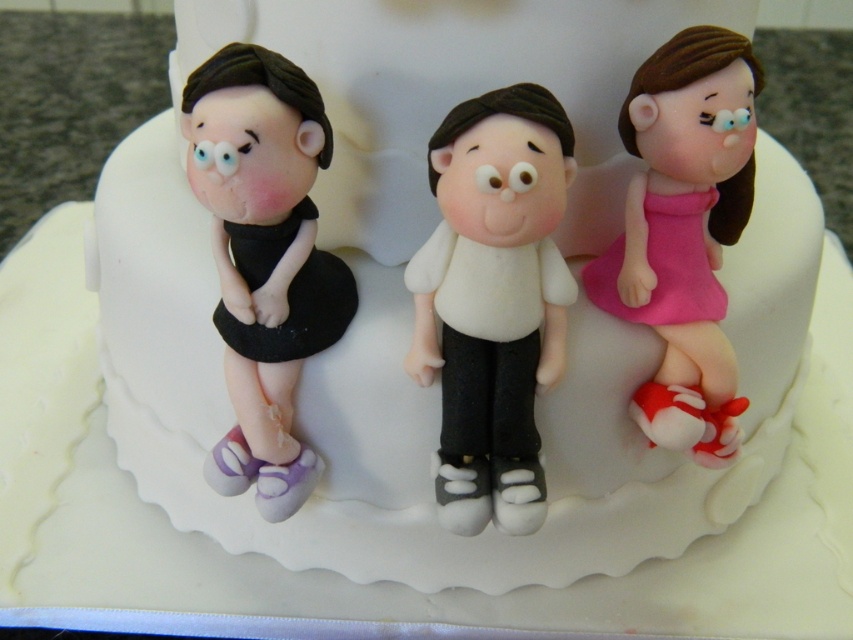
You are looking at the cake topper and notice two points marked on it. The first point is at coordinate point (502,128) and the second is at point (642,132). Which of these points is closer to you?

Point (502,128) is closer to the viewer than point (642,132).

You are a photographer setting up a shot of the cake topper. The matte black dress at left is part of the scene. You want to ensure the dress is in focus while keeping the camera at a fixed position. What should you adjust to achieve this?

To ensure the matte black dress at left is in focus while keeping the camera at a fixed position, you should adjust the camera lens to focus on the matte black dress at left. Since the matte black dress at left and the camera are 70.46 centimeters apart, setting the focus distance to approximately 70.46 centimeters would bring the dress into sharp focus.

You are designing a display stand for the white matte figure at center and the pink matte dress at right. Which object requires a wider base to prevent tipping over?

The white matte figure at center requires a wider base since it is wider than the pink matte dress at right, which helps prevent tipping over.